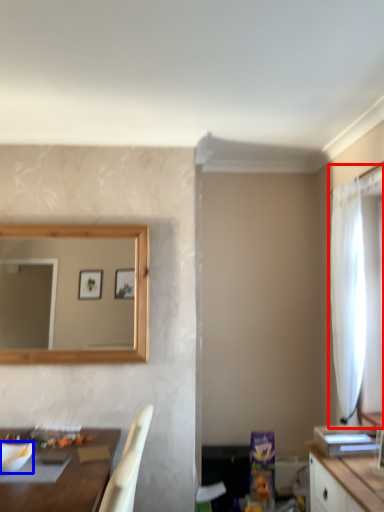
Question: Which object is further to the camera taking this photo, curtain (highlighted by a red box) or mixing bowl (highlighted by a blue box)?

Choices:
 (A) curtain
 (B) mixing bowl

Answer: (A)